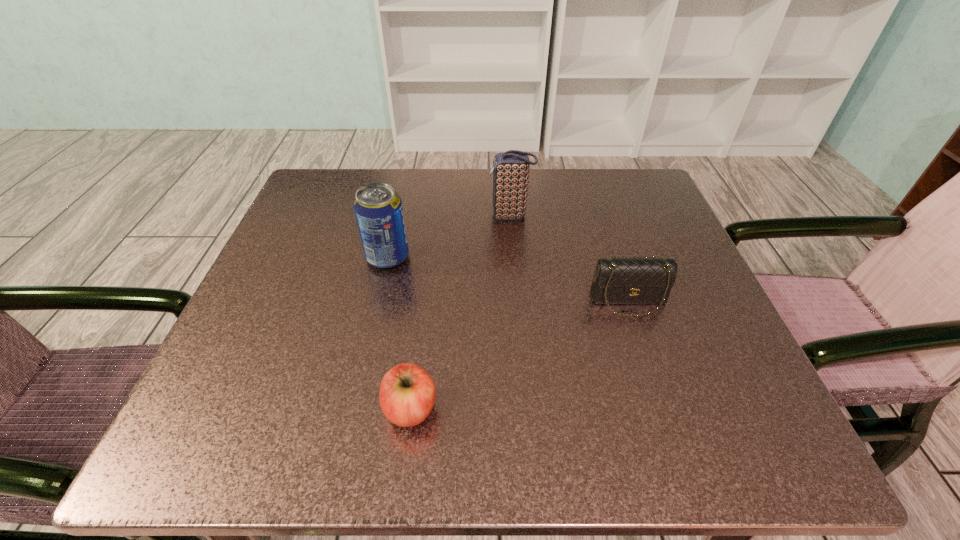
Locate an element on the screen. This screenshot has width=960, height=540. free point between the nearest object and the shorter clutch bag is located at coordinates (519, 355).

Find the location of a particular element. The image size is (960, 540). free space that is in between the rightmost object and the nearest object is located at coordinates (519, 355).

I want to click on vacant area between the apple and the right clutch bag, so click(x=519, y=355).

Image resolution: width=960 pixels, height=540 pixels. I want to click on object that stands as the closest to the third nearest object, so click(x=510, y=169).

I want to click on object that is the second closest to the left clutch bag, so click(x=621, y=280).